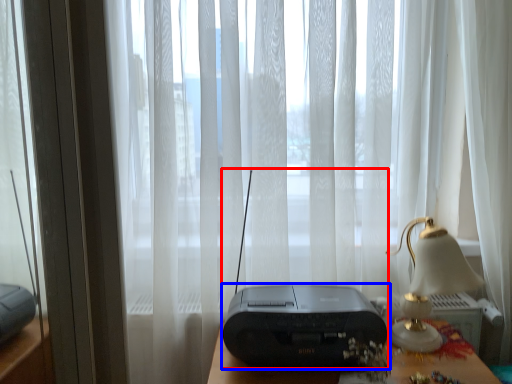
Question: Which of the following is the closest to the observer, gadget (highlighted by a red box) or printer (highlighted by a blue box)?

Choices:
 (A) gadget
 (B) printer

Answer: (A)